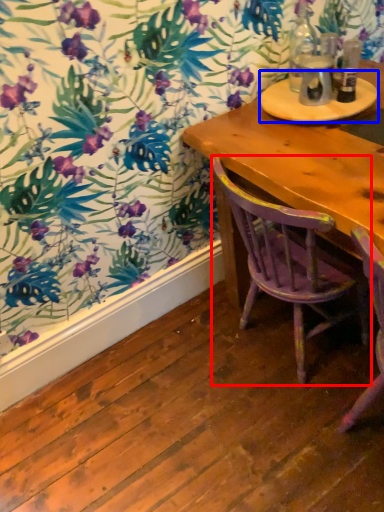
Question: Among these objects, which one is nearest to the camera, chair (highlighted by a red box) or round table (highlighted by a blue box)?

Choices:
 (A) chair
 (B) round table

Answer: (A)